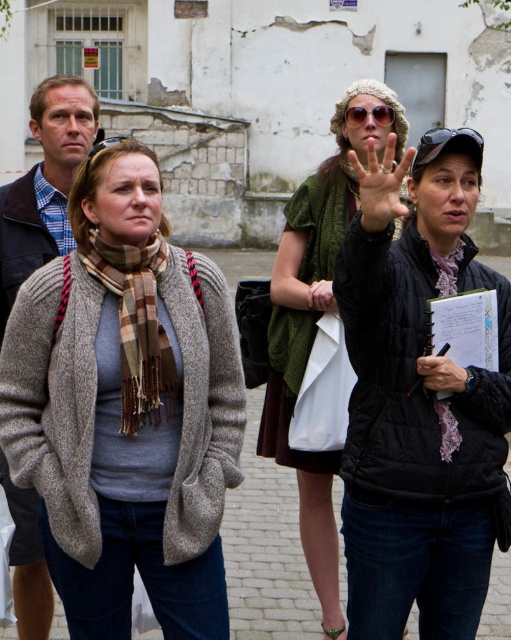
Question: Which point is farther to the camera?

Choices:
 (A) (300, 481)
 (B) (137, 323)
 (C) (41, 452)
 (D) (9, 278)

Answer: (A)

Question: Which of the following is the farthest from the observer?

Choices:
 (A) smooth black pen at lower right
 (B) black plastic sunglasses at upper right

Answer: (B)

Question: Which point is closer to the camera taking this photo?

Choices:
 (A) [142, 355]
 (B) [411, 458]
 (C) [384, 195]

Answer: (C)

Question: Does knitted green scarf at center have a smaller size compared to black plastic sunglasses at upper right?

Choices:
 (A) no
 (B) yes

Answer: (B)

Question: Is black plastic sunglasses at upper right closer to camera compared to sunglasses at center?

Choices:
 (A) no
 (B) yes

Answer: (B)

Question: Can you confirm if knitted gray cardigan at center is bigger than knitted green scarf at center?

Choices:
 (A) no
 (B) yes

Answer: (A)